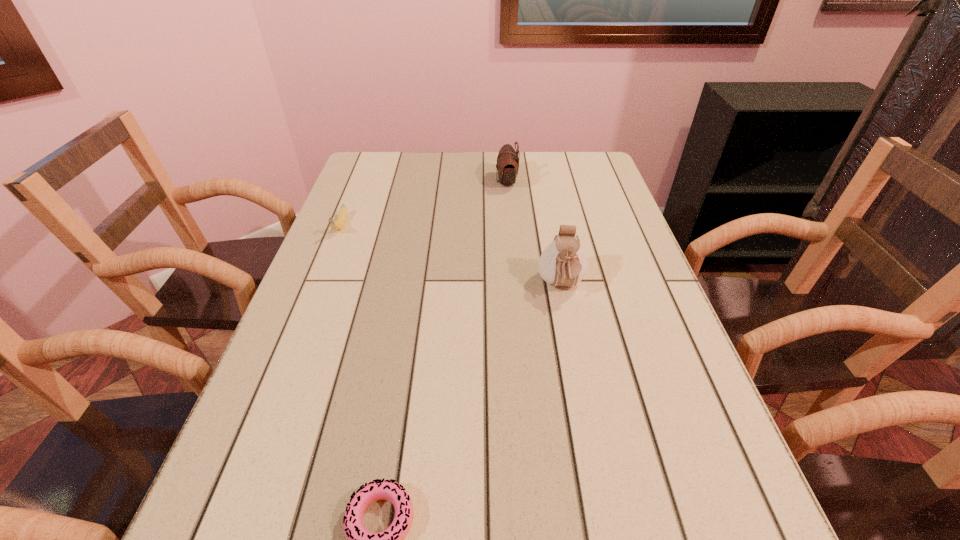
In order to click on vacant space positioned at the stem of the banana in this screenshot , I will do `click(310, 302)`.

Identify the location of object present at the far edge. (507, 165).

Find the location of `object that is at the left edge`. object that is at the left edge is located at coordinates (340, 222).

At what (x,y) coordinates should I click in order to perform the action: click on object located in the right edge section of the desktop. Please return your answer as a coordinate pair (x, y). The height and width of the screenshot is (540, 960). Looking at the image, I should click on (563, 262).

This screenshot has height=540, width=960. Identify the location of vacant space at the far edge. (418, 168).

Image resolution: width=960 pixels, height=540 pixels. In the image, there is a desktop. Identify the location of vacant region at the left edge. (370, 246).

The image size is (960, 540). In the image, there is a desktop. In order to click on vacant space at the right edge in this screenshot , I will do `click(637, 327)`.

At what (x,y) coordinates should I click in order to perform the action: click on free space at the far left corner of the desktop. Please return your answer as a coordinate pair (x, y). The image size is (960, 540). Looking at the image, I should click on (388, 152).

Where is `free region at the far right corner of the desktop`? This screenshot has width=960, height=540. free region at the far right corner of the desktop is located at coordinates (568, 158).

At what (x,y) coordinates should I click in order to perform the action: click on empty space between the leftmost object and the rightmost object. Please return your answer as a coordinate pair (x, y). This screenshot has width=960, height=540. Looking at the image, I should click on (451, 256).